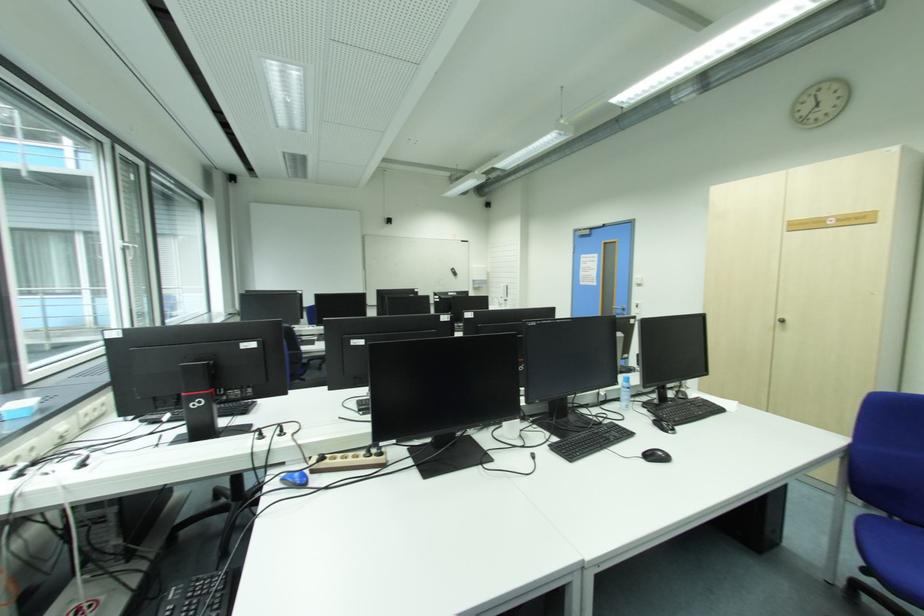
Where is `silver door handle`? This screenshot has width=924, height=616. silver door handle is located at coordinates (781, 321).